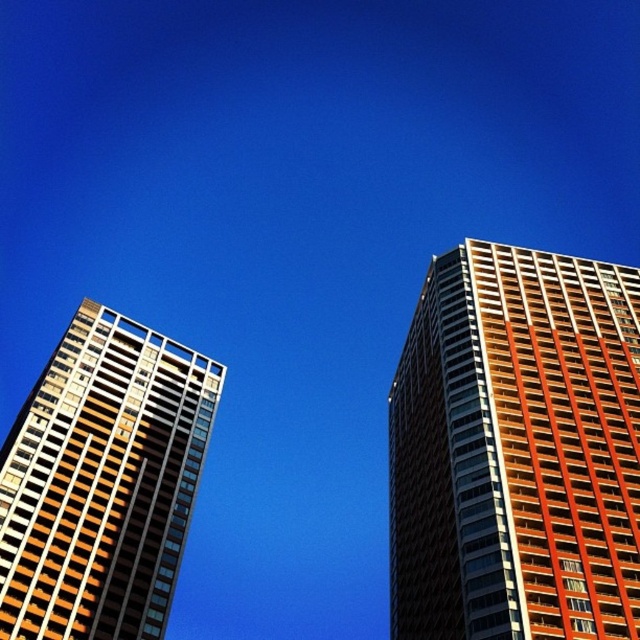
Which is more to the right, orange glass building at right or matte glass building at left?

Positioned to the right is orange glass building at right.

Measure the distance between point (406, 392) and camera.

A distance of 311.82 feet exists between point (406, 392) and camera.

Who is more distant from viewer, (600, 468) or (76, 477)?

Point (76, 477)

This screenshot has height=640, width=640. I want to click on orange glass building at right, so click(x=516, y=451).